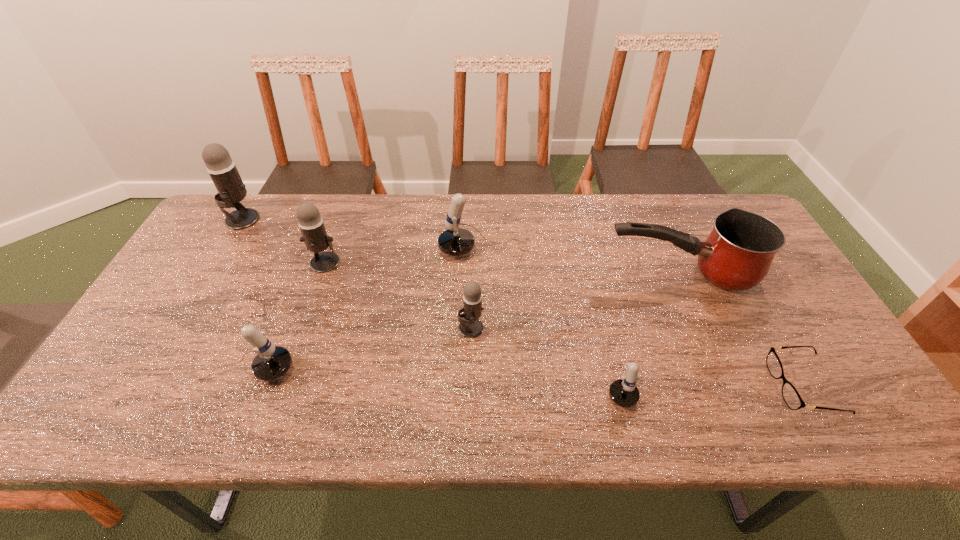
The image size is (960, 540). I want to click on vacant area that lies between the nearest gray microphone and the leftmost white microphone, so click(360, 349).

Locate an element on the screen. This screenshot has width=960, height=540. vacant space that is in between the spectacles and the smallest gray microphone is located at coordinates (637, 357).

I want to click on empty space between the smallest white microphone and the rightmost gray microphone, so click(x=544, y=353).

I want to click on free space between the saucepan and the second shortest object, so click(x=648, y=326).

I want to click on the third closest object to the spectacles, so click(455, 241).

Locate an element on the screen. This screenshot has width=960, height=540. object that is the second closest one to the biggest white microphone is located at coordinates (737, 254).

This screenshot has height=540, width=960. What are the coordinates of `microphone that is the fourth closest to the second nearest gray microphone` in the screenshot? It's located at (470, 327).

Locate an element on the screen. This screenshot has height=540, width=960. microphone that stands as the second closest to the second white microphone from right to left is located at coordinates (311, 224).

I want to click on the second closest gray microphone relative to the second smallest white microphone, so click(x=470, y=327).

The image size is (960, 540). In order to click on gray microphone that can be found as the second closest to the spectacles in this screenshot , I will do `click(311, 224)`.